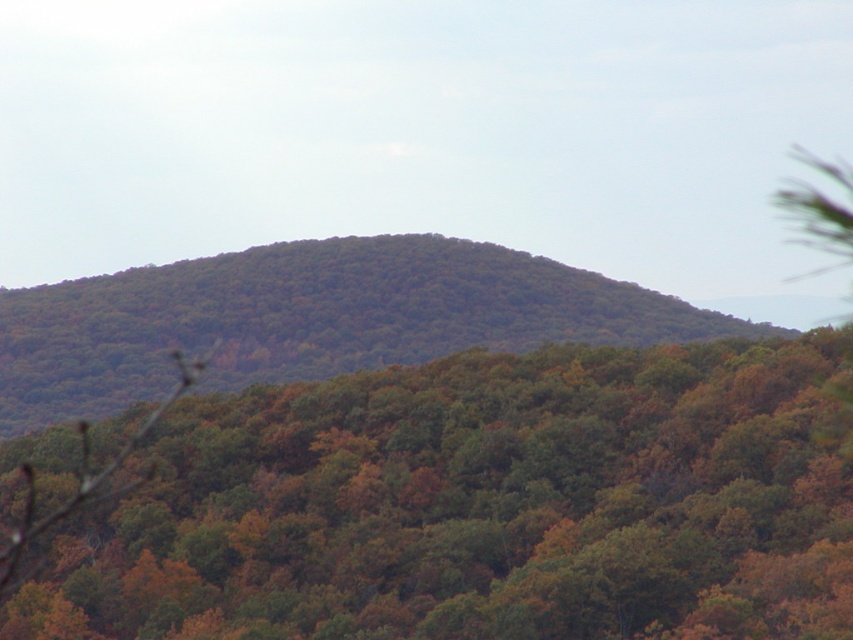
Question: From the image, what is the correct spatial relationship of green matte forest at center in relation to green leafy forest at center?

Choices:
 (A) right
 (B) left

Answer: (A)

Question: Which of the following is the closest to the observer?

Choices:
 (A) green leafy forest at center
 (B) green matte forest at center

Answer: (B)

Question: Which of the following is the farthest from the observer?

Choices:
 (A) (175, 628)
 (B) (447, 289)

Answer: (B)

Question: Is green matte forest at center smaller than green leafy forest at center?

Choices:
 (A) yes
 (B) no

Answer: (B)

Question: Is green matte forest at center to the right of green leafy forest at center from the viewer's perspective?

Choices:
 (A) no
 (B) yes

Answer: (B)

Question: Which object is closer to the camera taking this photo?

Choices:
 (A) green leafy forest at center
 (B) green matte forest at center

Answer: (B)